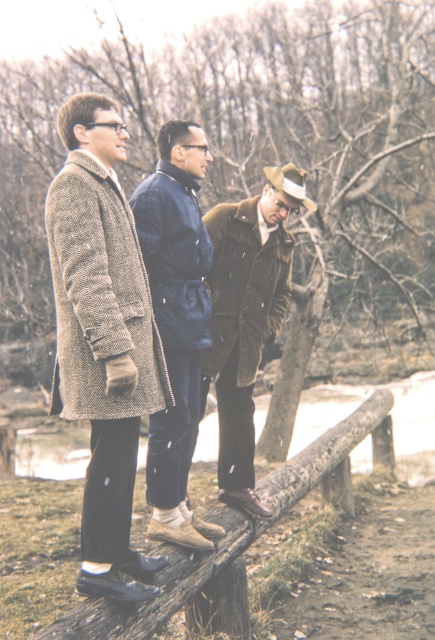
Question: Is blue down jacket at center to the right of brown wooden rail at center from the viewer's perspective?

Choices:
 (A) yes
 (B) no

Answer: (B)

Question: Which point is farther to the camera?

Choices:
 (A) (119, 362)
 (B) (251, 252)

Answer: (B)

Question: Which of these objects is positioned farthest from the brown fuzzy coat at center?

Choices:
 (A) blue down jacket at center
 (B) brown tweed coat at left

Answer: (B)

Question: Is brown tweed coat at left above brown wooden rail at center?

Choices:
 (A) no
 (B) yes

Answer: (B)

Question: Can you confirm if blue down jacket at center is positioned to the right of brown fuzzy coat at center?

Choices:
 (A) no
 (B) yes

Answer: (A)

Question: Among these objects, which one is nearest to the camera?

Choices:
 (A) brown fuzzy coat at center
 (B) blue down jacket at center

Answer: (B)